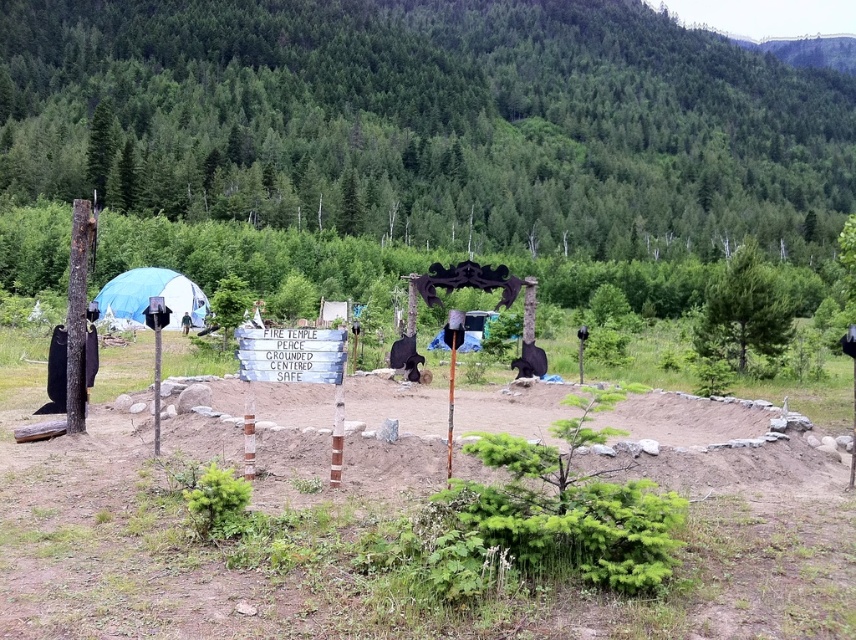
Based on the scene description, which object is positioned lower in the image, the green leafy tree at upper right or the smooth brown pole at left?

The green leafy tree at upper right is positioned lower than the smooth brown pole at left according to the description.

You are standing at the center of the clearing where the wooden signpost is located. Looking towards the upper right corner of the scene, what object is located at the coordinates point (744, 308)?

The point (744, 308) marks a green leafy tree at upper right.

You are planning to set up a tent between the green leafy tree at upper right and the smooth brown pole at left. Given that your tent requires a minimum of 20 meters of space between these two landmarks for proper setup, is the available distance sufficient?

The distance between the green leafy tree at upper right and the smooth brown pole at left is 25.07 meters, which exceeds the required 20 meters. Therefore, the available space is sufficient for setting up the tent.